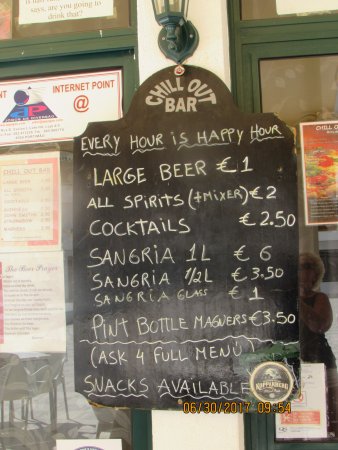
The width and height of the screenshot is (338, 450). I want to click on pieces of paper taped on window, so click(56, 286), click(37, 208).